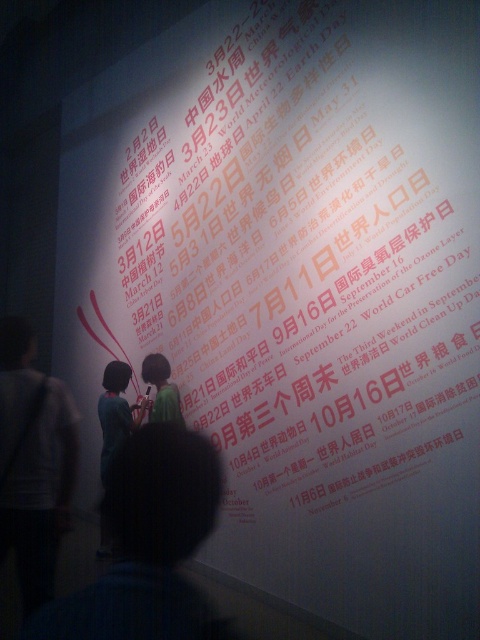
You are a photographer holding a camera and standing near the projection screen. You want to take a clear photo of the dark blue shirt at center displayed on the screen. However, you notice that the camera is currently positioned 35.36 inches away from the shirt. What adjustment should you make to ensure the entire shirt is in focus?

The dark blue shirt at center and camera are 35.36 inches apart. To ensure the entire shirt is in focus, you should move the camera closer to the dark blue shirt at center so that the distance is within the camera lens focusing range.

You are at a presentation and need to present a slide about the events shown on the projection screen. You have to choose between wearing the dark blue shirt at center or the light gray jacket at left. Which one will allow you to be seen better by the audience?

The light gray jacket at left is taller than the dark blue shirt at center, so wearing the light gray jacket at left would make you more visible to the audience.

You are organizing a clothing display and need to arrange the dark blue shirt at center and the light gray jacket at left according to their positions in the image. Which item should be placed to the right of the other?

The dark blue shirt at center should be placed to the right of the light gray jacket at left as per their positions in the image.